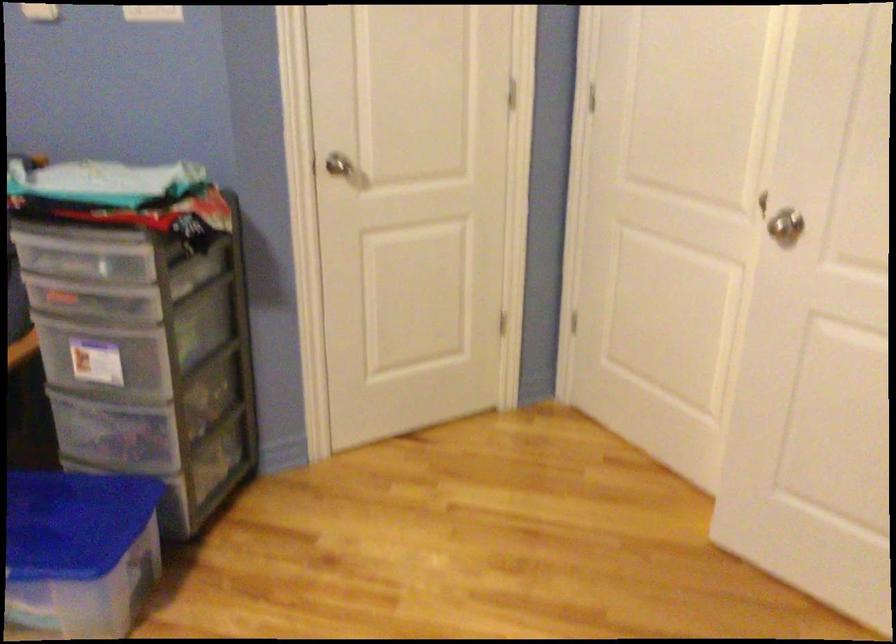
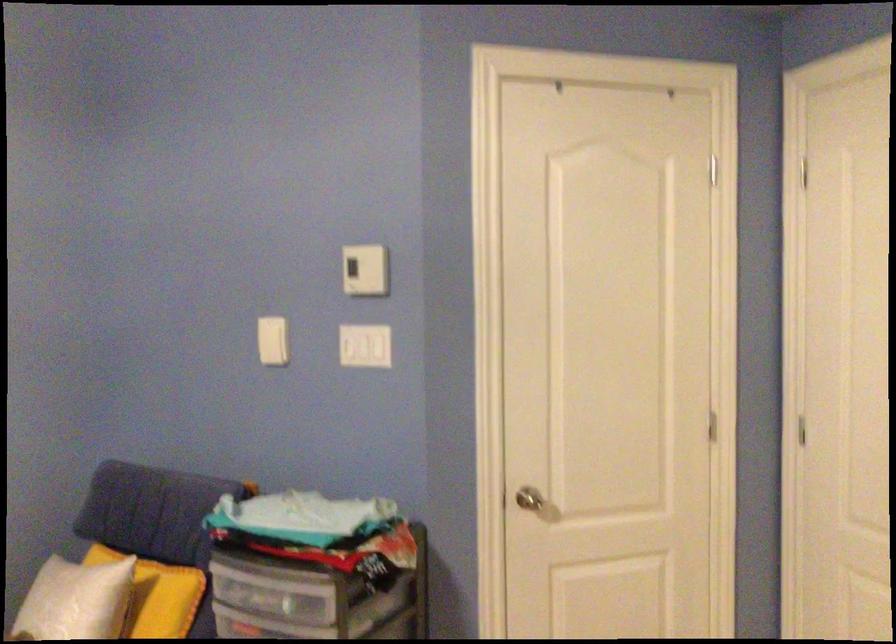
Consider the image. The first image is from the beginning of the video and the second image is from the end. How did the camera likely rotate when shooting the video?

The rotation direction of the camera is left-up.